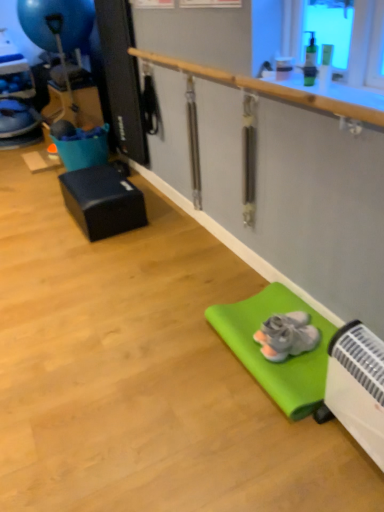
What are the coordinates of `vacant area that lies in front of gray suede sneakers at lower right` in the screenshot? It's located at (x=304, y=371).